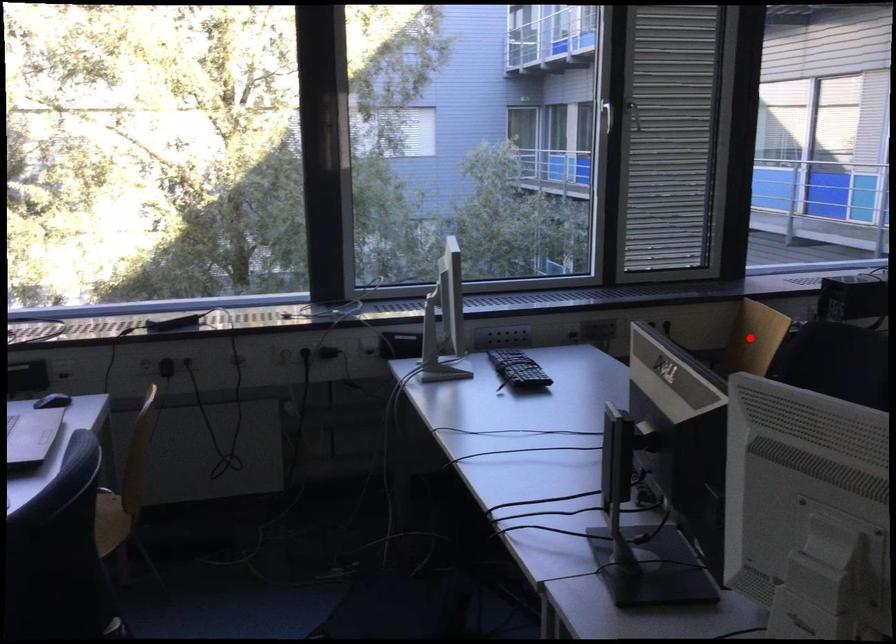
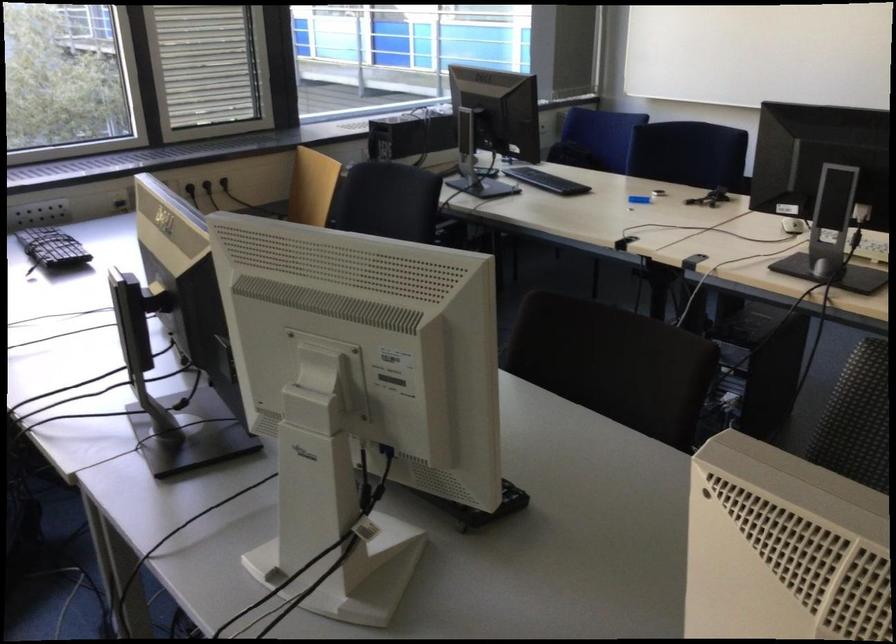
Where in the second image is the point corresponding to the highlighted location from the first image?

(312, 187)